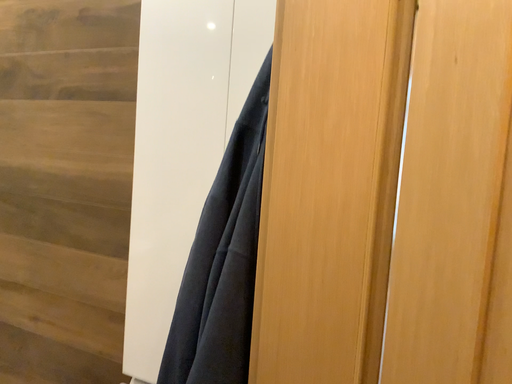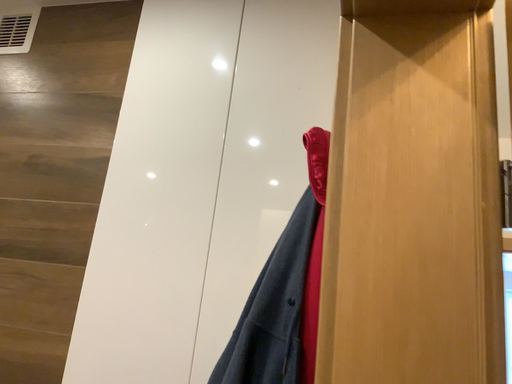
Question: How did the camera likely rotate when shooting the video?

Choices:
 (A) rotated downward
 (B) rotated upward

Answer: (B)